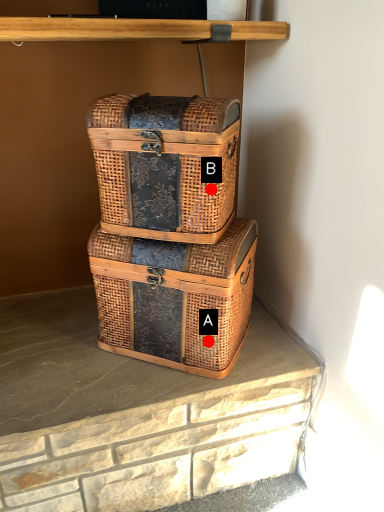
Question: Two points are circled on the image, labeled by A and B beside each circle. Which point is farther from the camera taking this photo?

Choices:
 (A) A is further
 (B) B is further

Answer: (A)